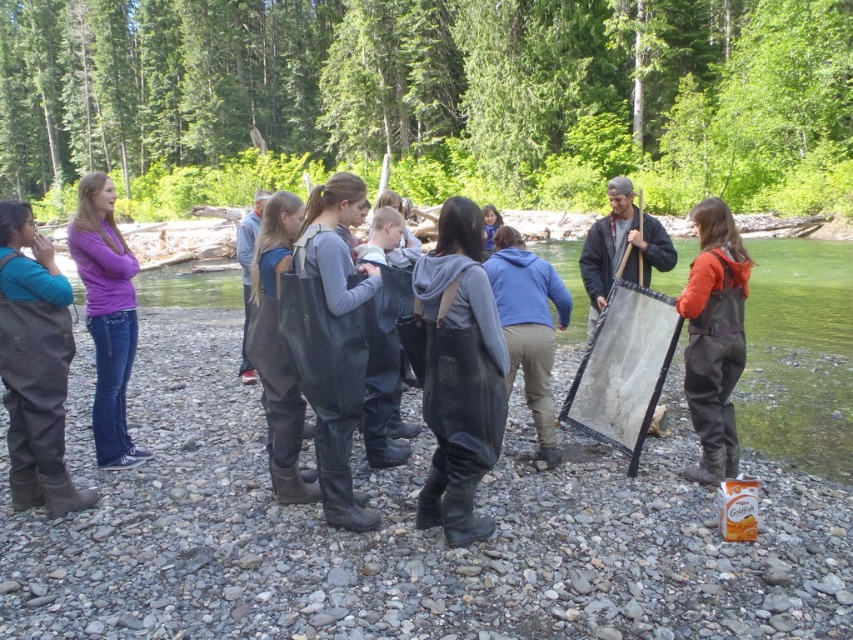
Does dark gray rubber waders at center have a lesser width compared to brown leather boots at left?

Indeed, dark gray rubber waders at center has a lesser width compared to brown leather boots at left.

Describe the element at coordinates (459, 372) in the screenshot. The height and width of the screenshot is (640, 853). I see `dark gray rubber waders at center` at that location.

Identify the location of dark gray rubber waders at center. (459, 372).

Can you confirm if brown leather boots at left is positioned to the right of purple softshell jacket at left?

Yes, brown leather boots at left is to the right of purple softshell jacket at left.

Locate an element on the screen. This screenshot has height=640, width=853. brown leather boots at left is located at coordinates (35, 365).

The width and height of the screenshot is (853, 640). What do you see at coordinates (35, 365) in the screenshot?
I see `brown leather boots at left` at bounding box center [35, 365].

Image resolution: width=853 pixels, height=640 pixels. I want to click on brown leather boots at left, so click(35, 365).

Does purple softshell jacket at left appear on the right side of blue fleece jacket at center?

No, purple softshell jacket at left is not to the right of blue fleece jacket at center.

The height and width of the screenshot is (640, 853). What are the coordinates of `purple softshell jacket at left` in the screenshot? It's located at (106, 316).